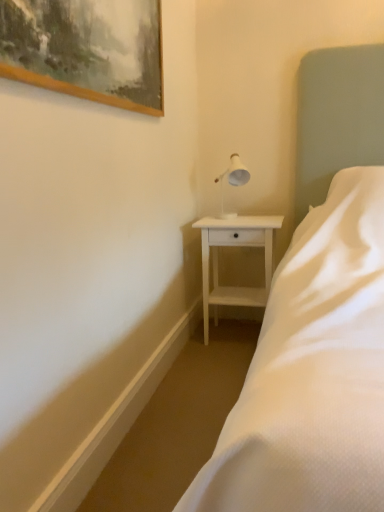
Describe the element at coordinates (318, 318) in the screenshot. I see `white satin bed at center` at that location.

Identify the location of white wood nightstand at center. (235, 246).

Considering the relative positions of white wood nightstand at center and wooden picture frame at upper left in the image provided, is white wood nightstand at center to the left or to the right of wooden picture frame at upper left?

In the image, white wood nightstand at center appears on the right side of wooden picture frame at upper left.

Who is smaller, white wood nightstand at center or wooden picture frame at upper left?

Smaller between the two is wooden picture frame at upper left.

Is white wood nightstand at center next to wooden picture frame at upper left?

There is a gap between white wood nightstand at center and wooden picture frame at upper left.

Looking at this image, measure the distance from white wood nightstand at center to wooden picture frame at upper left.

A distance of 3.60 feet exists between white wood nightstand at center and wooden picture frame at upper left.

Does point (232, 212) come in front of point (333, 443)?

No.

Identify the location of table lamp behind the white satin bed at center. (235, 172).

Could you tell me if white glossy table lamp at upper right is turned towards white satin bed at center?

No, white glossy table lamp at upper right is not oriented towards white satin bed at center.

Based on the photo, considering the relative sizes of white glossy table lamp at upper right and white satin bed at center in the image provided, is white glossy table lamp at upper right thinner than white satin bed at center?

Yes, white glossy table lamp at upper right is thinner than white satin bed at center.

In the image, is white satin bed at center on the left side or the right side of white wood nightstand at center?

white satin bed at center is to the right of white wood nightstand at center.

From a real-world perspective, between white satin bed at center and white wood nightstand at center, who is vertically lower?

In real-world perspective, white wood nightstand at center is lower.

Are white satin bed at center and white wood nightstand at center located far from each other?

That's not correct — white satin bed at center is a little close to white wood nightstand at center.

From the picture: Is white satin bed at center turned away from white wood nightstand at center?

white satin bed at center is not turned away from white wood nightstand at center.

Can you confirm if wooden picture frame at upper left is positioned to the right of white wood nightstand at center?

No.

Is wooden picture frame at upper left taller or shorter than white wood nightstand at center?

Clearly, wooden picture frame at upper left is shorter compared to white wood nightstand at center.

From the image's perspective, is wooden picture frame at upper left on white wood nightstand at center?

Yes, from the image's perspective, wooden picture frame at upper left is over white wood nightstand at center.

Based on their sizes in the image, would you say wooden picture frame at upper left is bigger or smaller than white wood nightstand at center?

wooden picture frame at upper left is smaller than white wood nightstand at center.

At what (x,y) coordinates should I click in order to perform the action: click on table lamp behind the wooden picture frame at upper left. Please return your answer as a coordinate pair (x, y). Looking at the image, I should click on (235, 172).

From the image's perspective, is wooden picture frame at upper left on top of white glossy table lamp at upper right?

Indeed, from the image's perspective, wooden picture frame at upper left is shown above white glossy table lamp at upper right.

Considering the sizes of objects wooden picture frame at upper left and white glossy table lamp at upper right in the image provided, who is shorter, wooden picture frame at upper left or white glossy table lamp at upper right?

white glossy table lamp at upper right.

Is wooden picture frame at upper left facing away from white glossy table lamp at upper right?

No, wooden picture frame at upper left is not facing away from white glossy table lamp at upper right.

Find the location of a particular element. nightstand behind the white satin bed at center is located at coordinates (235, 246).

Considering the relative positions of white wood nightstand at center and white satin bed at center in the image provided, is white wood nightstand at center to the right of white satin bed at center from the viewer's perspective?

No, white wood nightstand at center is not to the right of white satin bed at center.

Is the surface of white wood nightstand at center in direct contact with white satin bed at center?

white wood nightstand at center and white satin bed at center are not in contact.

Can you confirm if white glossy table lamp at upper right is bigger than wooden picture frame at upper left?

No.

From the image's perspective, is white glossy table lamp at upper right on wooden picture frame at upper left?

Incorrect, from the image's perspective, white glossy table lamp at upper right is lower than wooden picture frame at upper left.

Is white glossy table lamp at upper right closer to camera compared to wooden picture frame at upper left?

No, white glossy table lamp at upper right is further to the viewer.

From a real-world perspective, is white glossy table lamp at upper right over wooden picture frame at upper left?

No.

What are the coordinates of `nightstand behind the wooden picture frame at upper left` in the screenshot? It's located at (235, 246).

The height and width of the screenshot is (512, 384). I want to click on table lamp lying above the white satin bed at center (from the image's perspective), so click(x=235, y=172).

When comparing their distances from wooden picture frame at upper left, does white wood nightstand at center or white satin bed at center seem further?

white wood nightstand at center lies further to wooden picture frame at upper left than the other object.

When comparing their distances from white satin bed at center, does white wood nightstand at center or white glossy table lamp at upper right seem further?

white glossy table lamp at upper right lies further to white satin bed at center than the other object.

Based on their spatial positions, is wooden picture frame at upper left or white satin bed at center further from white wood nightstand at center?

wooden picture frame at upper left.

Estimate the real-world distances between objects in this image. Which object is closer to white satin bed at center, wooden picture frame at upper left or white wood nightstand at center?

white wood nightstand at center.

From the image, which object appears to be farther from white satin bed at center, white glossy table lamp at upper right or white wood nightstand at center?

Answer: white glossy table lamp at upper right is further to white satin bed at center.

Considering their positions, is white wood nightstand at center positioned further to white satin bed at center than wooden picture frame at upper left?

wooden picture frame at upper left is further to white satin bed at center.

In the scene shown: When comparing their distances from wooden picture frame at upper left, does white satin bed at center or white glossy table lamp at upper right seem further?

Based on the image, white glossy table lamp at upper right appears to be further to wooden picture frame at upper left.

In the scene shown: Which object lies further to the anchor point white glossy table lamp at upper right, white satin bed at center or wooden picture frame at upper left?

The object further to white glossy table lamp at upper right is wooden picture frame at upper left.

Locate an element on the screen. This screenshot has height=512, width=384. picture frame between white satin bed at center and white glossy table lamp at upper right in the front-back direction is located at coordinates [x=86, y=49].

You are a GUI agent. You are given a task and a screenshot of the screen. Output one action in this format:
    pyautogui.click(x=<x>, y=<y>)
    Task: Click on the nightstand between white satin bed at center and white glossy table lamp at upper right from front to back
    
    Given the screenshot: What is the action you would take?
    pyautogui.click(x=235, y=246)

The image size is (384, 512). Identify the location of picture frame between white satin bed at center and white wood nightstand at center along the z-axis. (86, 49).

Find the location of a particular element. nightstand located between wooden picture frame at upper left and white glossy table lamp at upper right in the depth direction is located at coordinates (235, 246).